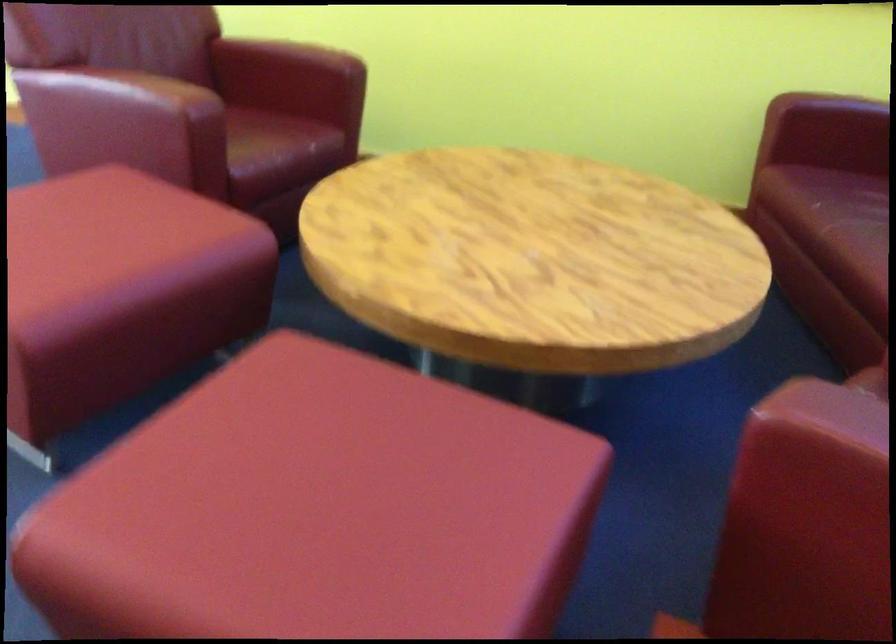
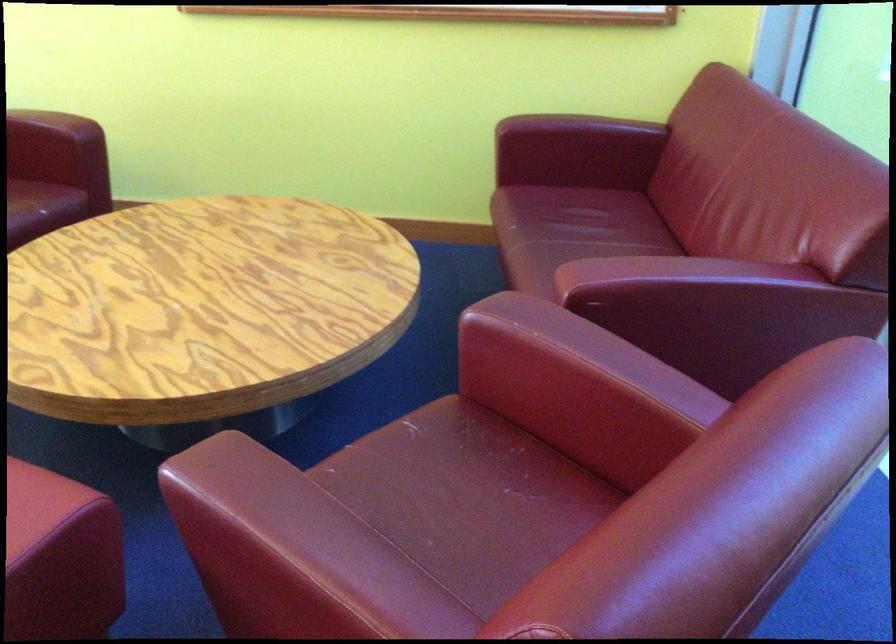
In the second image, find the point that corresponds to (321,154) in the first image.

(46, 209)